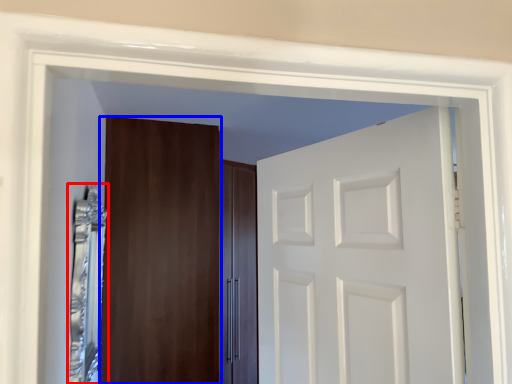
Question: Which object appears farthest to the camera in this image, mirror (highlighted by a red box) or door (highlighted by a blue box)?

Choices:
 (A) mirror
 (B) door

Answer: (B)